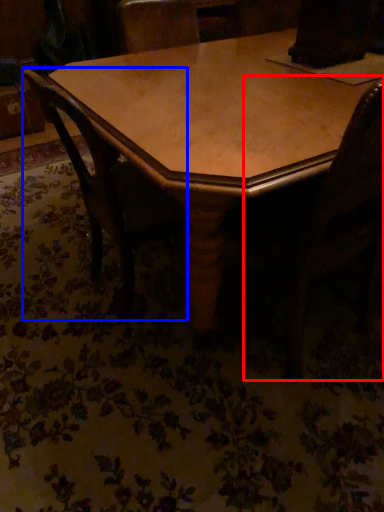
Question: Which object is closer to the camera taking this photo, swivel chair (highlighted by a red box) or chair (highlighted by a blue box)?

Choices:
 (A) swivel chair
 (B) chair

Answer: (A)